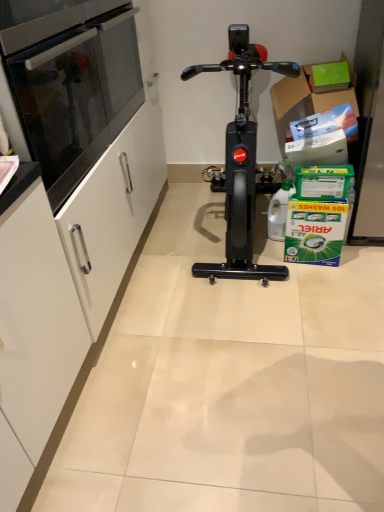
Question: From a real-world perspective, is black glass oven at left under black granite countertop at left?

Choices:
 (A) no
 (B) yes

Answer: (A)

Question: Does black glass oven at left have a greater height compared to black granite countertop at left?

Choices:
 (A) yes
 (B) no

Answer: (A)

Question: Considering the relative sizes of black glass oven at left and black granite countertop at left in the image provided, is black glass oven at left bigger than black granite countertop at left?

Choices:
 (A) no
 (B) yes

Answer: (B)

Question: Is black glass oven at left closer to the viewer compared to black granite countertop at left?

Choices:
 (A) no
 (B) yes

Answer: (A)

Question: Can you confirm if black glass oven at left is positioned to the right of black granite countertop at left?

Choices:
 (A) no
 (B) yes

Answer: (A)

Question: From a real-world perspective, is black glass oven at left physically located above or below green cardboard box at upper right?

Choices:
 (A) above
 (B) below

Answer: (A)

Question: In the image, is black glass oven at left on the left side or the right side of green cardboard box at upper right?

Choices:
 (A) left
 (B) right

Answer: (A)

Question: Is black glass oven at left in front of or behind green cardboard box at upper right in the image?

Choices:
 (A) behind
 (B) front

Answer: (B)

Question: Would you say black glass oven at left is inside or outside green cardboard box at upper right?

Choices:
 (A) outside
 (B) inside

Answer: (A)

Question: Considering the positions of black glass oven at left and black glossy stationary bicycle at center in the image, is black glass oven at left wider or thinner than black glossy stationary bicycle at center?

Choices:
 (A) thin
 (B) wide

Answer: (A)

Question: Does point (140, 82) appear closer or farther from the camera than point (244, 120)?

Choices:
 (A) farther
 (B) closer

Answer: (A)

Question: From their relative heights in the image, would you say black glass oven at left is taller or shorter than black glossy stationary bicycle at center?

Choices:
 (A) tall
 (B) short

Answer: (B)

Question: Is black glass oven at left inside or outside of black glossy stationary bicycle at center?

Choices:
 (A) outside
 (B) inside

Answer: (A)

Question: From the image's perspective, is black glossy stationary bicycle at center located above or below green cardboard box at upper right?

Choices:
 (A) above
 (B) below

Answer: (B)

Question: Would you say black glossy stationary bicycle at center is to the left or to the right of green cardboard box at upper right in the picture?

Choices:
 (A) left
 (B) right

Answer: (A)